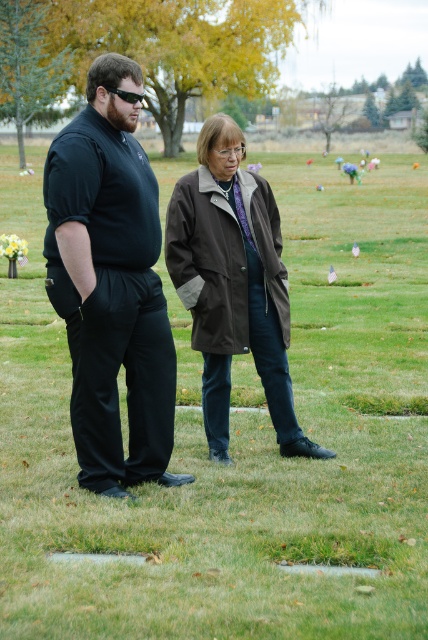
You are a photographer trying to capture both the matte black pants at center and the brown canvas coat at center in a single frame. Given their sizes, which object should you focus on to ensure both are clearly visible in the photo?

Since the matte black pants at center is smaller than the brown canvas coat at center, you should focus on the brown canvas coat at center to ensure both objects are clearly visible in the photo.

You are a photographer trying to capture the matte black pants at center in your shot. Based on the coordinates provided, where should you position your camera to ensure the pants are centered in your frame?

The matte black pants at center are located at coordinates point (110, 284), so positioning your camera to aim directly at that point will center them in your frame.

You are a photographer trying to capture a photo of the matte black pants at center and the brown canvas coat at center. Based on their heights, which object should you focus on first if you want to ensure both are in frame without cropping?

The matte black pants at center is taller than the brown canvas coat at center. To ensure both are in frame without cropping, focus on the taller object first, which is the matte black pants at center, then adjust the frame to include the shorter one.